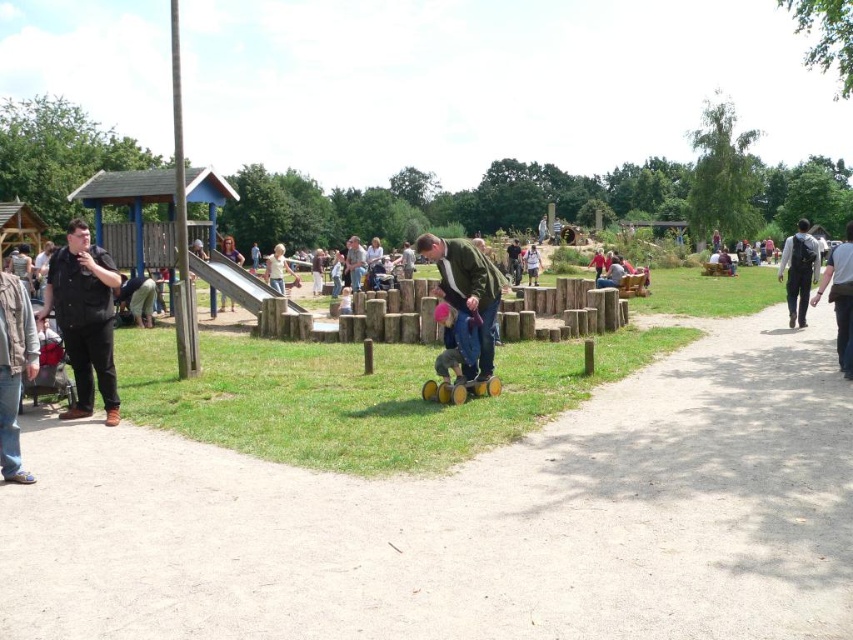
You are a hiker who has just finished a long trek and wants to place your dark gray backpack at right on the ground. However, you also need to ensure that it stays at least 8 meters away from the pink fabric at center. Based on the scene, can you safely place your backpack there?

The distance between the dark gray backpack at right and the pink fabric at center is 7.95 meters, which is slightly less than the required 8 meters. Therefore, placing the backpack there would not meet the safety requirement.

You are organizing a picnic and need to pack items into the dark gray backpack at right and the pink fabric at center. Which container can hold more items based on their sizes?

The dark gray backpack at right has a larger size compared to the pink fabric at center, so it can hold more items.

You are a delivery person who needs to deliver a package to a person wearing a matte green jacket at center. There is also a person in a dark brown leather jacket at left. The package can only be delivered to the person closest to you. Which jacket should you deliver the package to?

The distance between matte green jacket at center and dark brown leather jacket at left is 27.44 feet. Since the package should go to the closest person, you need to determine which is nearer. However, the description only provides the distance between them, not your position. Without knowing your location, it is impossible to determine who is closer to you. Please clarify your position relative to both jackets.